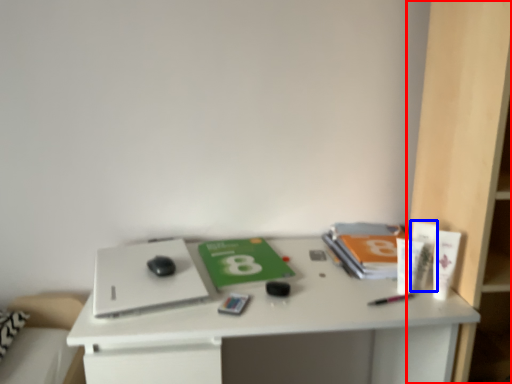
Question: Which object is further to the camera taking this photo, bookshelf (highlighted by a red box) or toiletry (highlighted by a blue box)?

Choices:
 (A) bookshelf
 (B) toiletry

Answer: (B)